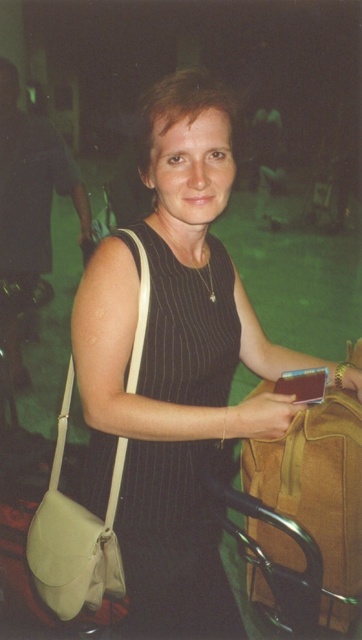
Question: Which point is farther to the camera?

Choices:
 (A) (326, 412)
 (B) (139, 225)

Answer: (A)

Question: Can you confirm if matte black dress at center is positioned to the right of beige leather bag at left?

Choices:
 (A) no
 (B) yes

Answer: (B)

Question: Which point appears closest to the camera in this image?

Choices:
 (A) (111, 515)
 (B) (255, 532)
 (C) (198, 284)
 (D) (225, 573)

Answer: (A)

Question: Which object is positioned closest to the brown suede briefcase at center?

Choices:
 (A) black pinstripe dress at center
 (B) beige leather bag at left

Answer: (A)

Question: Can you confirm if matte black dress at center is thinner than black pinstripe dress at center?

Choices:
 (A) no
 (B) yes

Answer: (A)

Question: Where is matte black dress at center located in relation to beige leather bag at left in the image?

Choices:
 (A) right
 (B) left

Answer: (A)